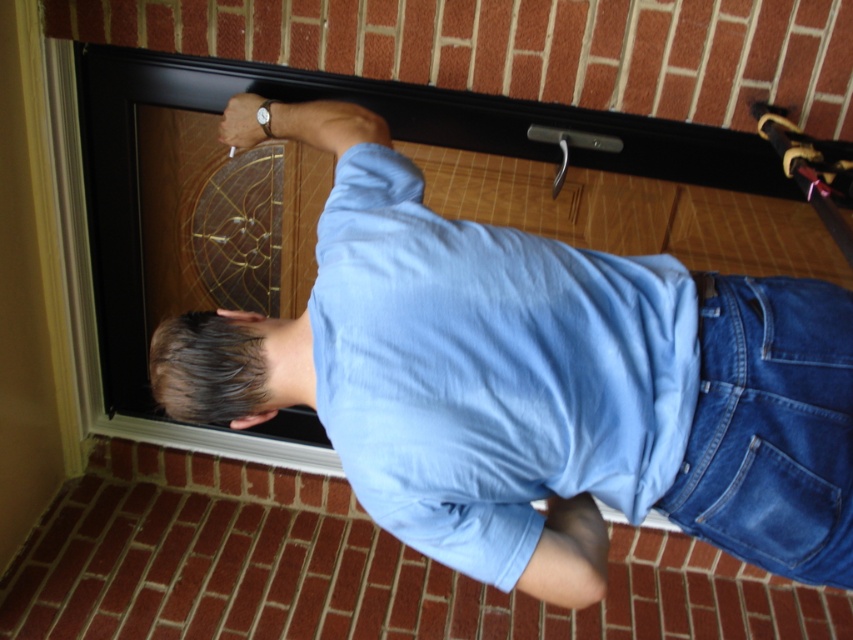
You are standing in front of a door and need to reach a point that is 36.57 inches away from you. Given the scene described, can you confirm if the point at coordinates point (498, 417) is within your reach?

The point at coordinates point (498, 417) is 36.57 inches away from the viewer, so yes, it is within reach.

You are a photographer aiming to capture a closeup of the light blue cotton shirt at center. Given that your camera can focus on objects within 30 inches, will you need to adjust your position to take the photo?

The light blue cotton shirt at center is 35.78 inches away from the camera, which is beyond the 30 inches focus range. You need to move closer to bring it within the focus range.

You are standing in front of the door and see the point marked at coordinates (532, 381). Which object from the scene is located at that point?

The point at coordinates (532, 381) marks the blue denim shirt at upper center.